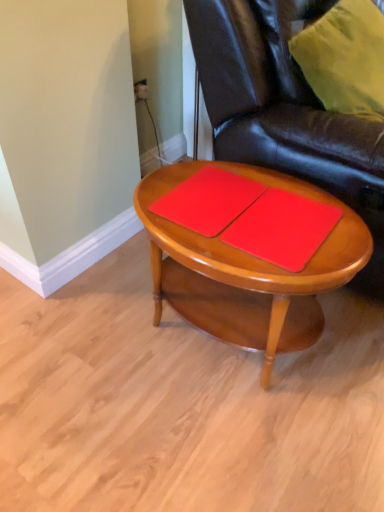
Question: Would you consider matte wood coffee table at center to be distant from glossy leather chair at center?

Choices:
 (A) no
 (B) yes

Answer: (A)

Question: Is matte wood coffee table at center aimed at glossy leather chair at center?

Choices:
 (A) yes
 (B) no

Answer: (B)

Question: From a real-world perspective, is matte wood coffee table at center below glossy leather chair at center?

Choices:
 (A) yes
 (B) no

Answer: (A)

Question: Can you confirm if matte wood coffee table at center is shorter than glossy leather chair at center?

Choices:
 (A) no
 (B) yes

Answer: (B)

Question: Is matte wood coffee table at center completely or partially outside of glossy leather chair at center?

Choices:
 (A) no
 (B) yes

Answer: (B)

Question: Is matte wood coffee table at center wider or thinner than matte red notebook at center, which is the 2th notebook in right-to-left order?

Choices:
 (A) thin
 (B) wide

Answer: (B)

Question: Is matte wood coffee table at center to the left or to the right of matte red notebook at center, which is the 2th notebook in right-to-left order, in the image?

Choices:
 (A) right
 (B) left

Answer: (A)

Question: Would you say matte wood coffee table at center is inside or outside matte red notebook at center, the 1th notebook from the left?

Choices:
 (A) inside
 (B) outside

Answer: (B)

Question: From the image's perspective, is matte wood coffee table at center located above or below matte red notebook at center, which is the 2th notebook in right-to-left order?

Choices:
 (A) above
 (B) below

Answer: (B)

Question: From the image's perspective, is glossy leather chair at center above or below matte wood coffee table at center?

Choices:
 (A) above
 (B) below

Answer: (A)

Question: From a real-world perspective, is glossy leather chair at center physically located above or below matte wood coffee table at center?

Choices:
 (A) above
 (B) below

Answer: (A)

Question: In terms of height, does glossy leather chair at center look taller or shorter compared to matte wood coffee table at center?

Choices:
 (A) tall
 (B) short

Answer: (A)

Question: Is point (342, 131) closer or farther from the camera than point (231, 274)?

Choices:
 (A) farther
 (B) closer

Answer: (A)

Question: From the image's perspective, is red matte notebook at center, acting as the 2th notebook starting from the left, positioned above or below matte wood coffee table at center?

Choices:
 (A) above
 (B) below

Answer: (A)

Question: From their relative heights in the image, would you say red matte notebook at center, which appears as the first notebook when viewed from the right, is taller or shorter than matte wood coffee table at center?

Choices:
 (A) tall
 (B) short

Answer: (B)